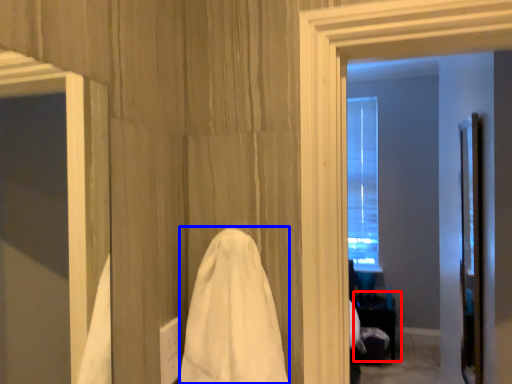
Question: Among these objects, which one is nearest to the camera, table (highlighted by a red box) or bath towel (highlighted by a blue box)?

Choices:
 (A) table
 (B) bath towel

Answer: (B)